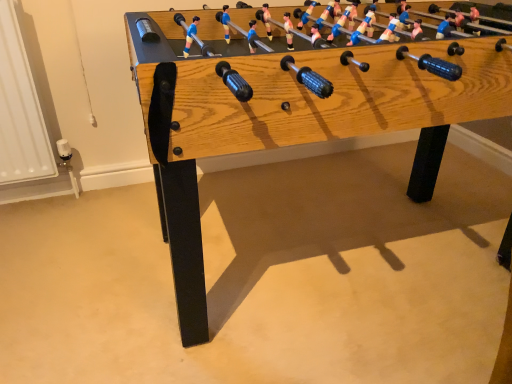
Image resolution: width=512 pixels, height=384 pixels. What do you see at coordinates (294, 119) in the screenshot? I see `wooden foosball table at center` at bounding box center [294, 119].

Identify the location of wooden foosball table at center. The width and height of the screenshot is (512, 384). (294, 119).

Where is `wooden foosball table at center`? The width and height of the screenshot is (512, 384). wooden foosball table at center is located at coordinates (294, 119).